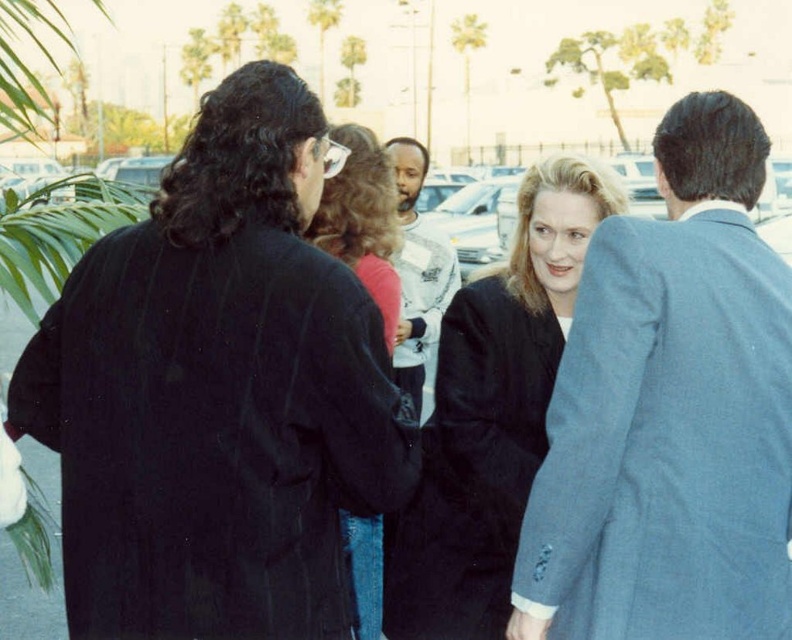
You are a photographer trying to capture a candid shot of the two people in the center wearing the matte black jacket at center and the white cotton shirt at center. Since you want to focus on their faces, which clothing item should you avoid placing in the foreground of your photo?

The matte black jacket at center is below the white cotton shirt at center, so to avoid blocking the faces, you should ensure the matte black jacket at center does not come into the foreground of the photo.

You are trying to decide which clothing item to grab quickly from the center of the image. The matte black jacket at center and the white cotton shirt at center are both in your reach. If you need to pick the taller one, which should you choose?

The white cotton shirt at center is taller than the matte black jacket at center, so you should choose the white cotton shirt at center.

You are organizing a charity event and need to decide which of the two outfits, the blue textured suit at right or the matte black coat at center, would be more suitable for a larger group photo where visibility is key. Based on their sizes, which one would stand out more?

The blue textured suit at right is bigger than the matte black coat at center, so it would stand out more in a group photo due to its larger size.